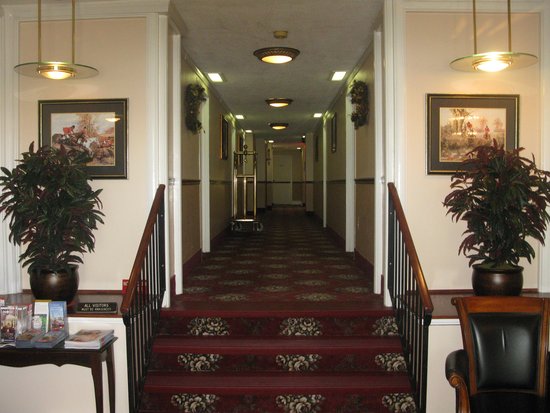
Identify the location of left handrail. (146, 247).